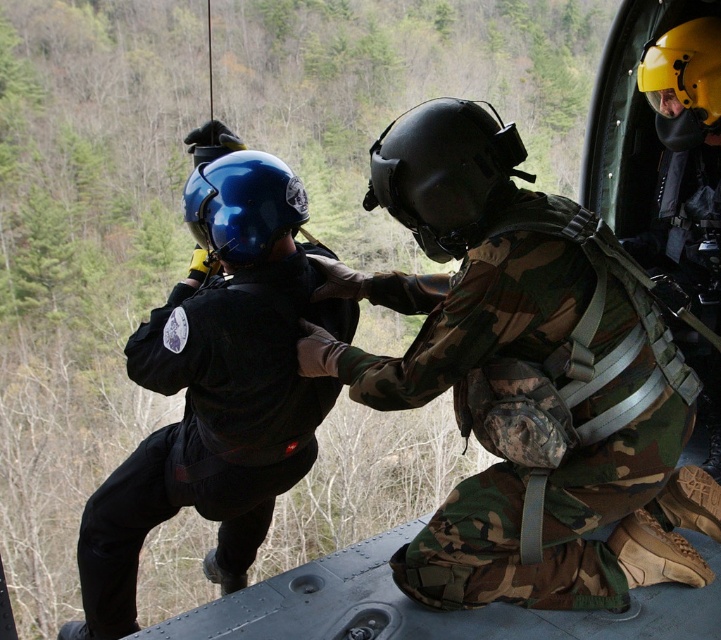
Between point (213, 316) and point (645, 93), which one is positioned in front?

Point (213, 316) is more forward.

Who is shorter, matte black helmet at left or yellow matte helmet at upper right?

yellow matte helmet at upper right is shorter.

Does point (278, 284) come farther from viewer compared to point (702, 19)?

No, it is in front of (702, 19).

Image resolution: width=721 pixels, height=640 pixels. What are the coordinates of `matte black helmet at left` in the screenshot? It's located at pos(216,392).

Is point (423, 163) closer to camera compared to point (274, 188)?

Yes, it is.

Between point (472, 225) and point (208, 220), which one is positioned behind?

The point (208, 220) is behind.

In order to click on black matte helmet at center in this screenshot , I will do `click(443, 172)`.

Which of these two, matte black helmet at left or glossy blue helmet at center, stands taller?

Standing taller between the two is matte black helmet at left.

Is point (123, 618) closer to viewer compared to point (247, 262)?

No, (123, 618) is behind (247, 262).

Is point (125, 524) positioned before point (231, 227)?

No.

Where is `matte black helmet at left`? The width and height of the screenshot is (721, 640). matte black helmet at left is located at coordinates (216, 392).